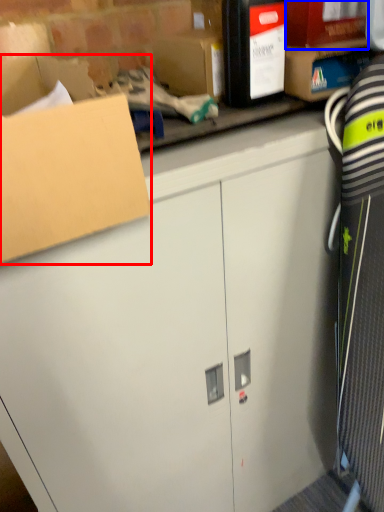
Question: Among these objects, which one is farthest to the camera, box (highlighted by a red box) or storage box (highlighted by a blue box)?

Choices:
 (A) box
 (B) storage box

Answer: (B)